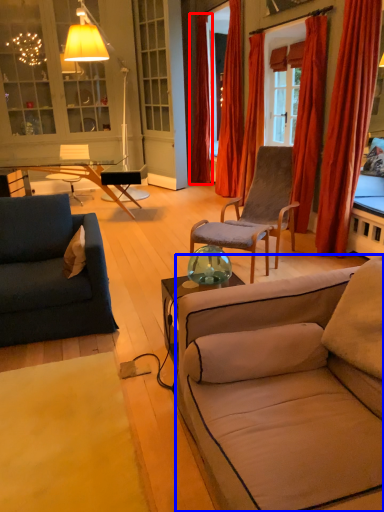
Question: Among these objects, which one is nearest to the camera, curtain (highlighted by a red box) or studio couch (highlighted by a blue box)?

Choices:
 (A) curtain
 (B) studio couch

Answer: (B)